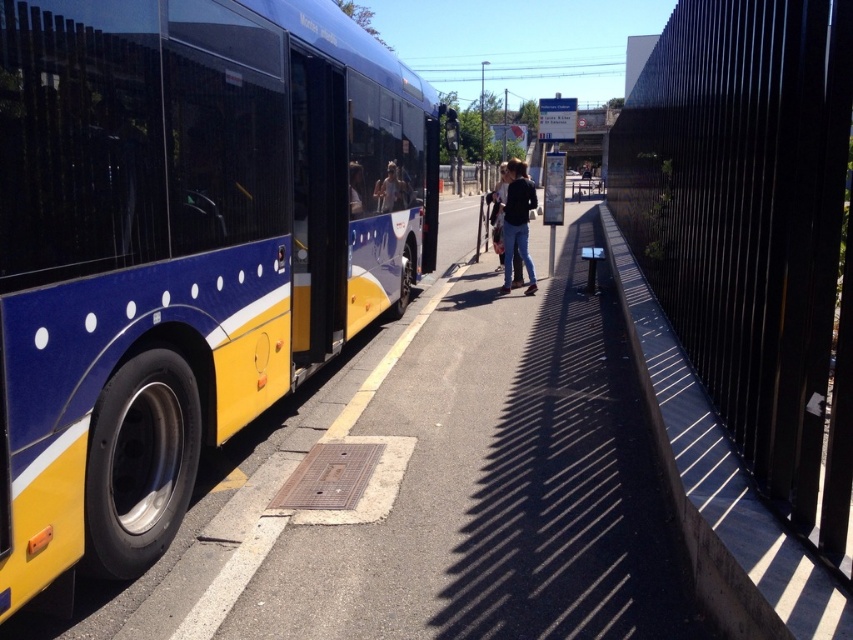
Question: Which of the following is the closest to the observer?

Choices:
 (A) (527, 259)
 (B) (199, 220)
 (C) (705, 520)

Answer: (C)

Question: Which object is farther from the camera taking this photo?

Choices:
 (A) denim jacket at center
 (B) black concrete curb at right
 (C) light blue fabric shirt at center

Answer: (A)

Question: In this image, where is blue/yellow painted bus at left located relative to smooth asphalt pavement at center?

Choices:
 (A) left
 (B) right

Answer: (A)

Question: Which object appears farthest from the camera in this image?

Choices:
 (A) denim jacket at center
 (B) black concrete curb at right
 (C) smooth asphalt pavement at center

Answer: (A)

Question: Can you confirm if blue/yellow painted bus at left is positioned above black concrete curb at right?

Choices:
 (A) yes
 (B) no

Answer: (A)

Question: Does blue/yellow painted bus at left appear over light blue fabric shirt at center?

Choices:
 (A) no
 (B) yes

Answer: (A)